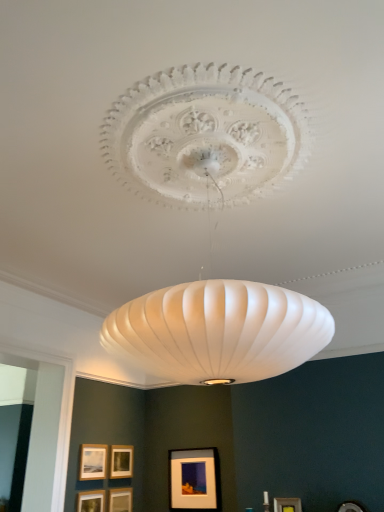
At what (x,y) coordinates should I click in order to perform the action: click on matte gold picture frame at lower left, which is the first picture frame from left to right. Please return your answer as a coordinate pair (x, y). This screenshot has height=512, width=384. Looking at the image, I should click on (93, 462).

What do you see at coordinates (121, 461) in the screenshot?
I see `matte gold picture frame at center, acting as the 4th picture frame starting from the right` at bounding box center [121, 461].

Identify the location of matte black picture frame at lower center, marked as the fifth picture frame in a left-to-right arrangement. (194, 479).

What do you see at coordinates (91, 501) in the screenshot?
I see `matte gold picture frame at lower center, which is counted as the second picture frame, starting from the left` at bounding box center [91, 501].

Where is `wooden picture frame at lower center, the 3th picture frame positioned from the right`? The image size is (384, 512). wooden picture frame at lower center, the 3th picture frame positioned from the right is located at coordinates (120, 500).

Consider the image. How much space does matte gold picture frame at lower center, the 1th picture frame when ordered from right to left, occupy vertically?

matte gold picture frame at lower center, the 1th picture frame when ordered from right to left, is 7.61 inches tall.

In order to click on matte gold picture frame at lower left, which is the first picture frame from left to right in this screenshot , I will do `click(93, 462)`.

Is matte black picture frame at lower center, marked as the 2th picture frame in a right-to-left arrangement, turned away from matte gold picture frame at lower center, which is the fifth picture frame from right to left?

No, matte black picture frame at lower center, marked as the 2th picture frame in a right-to-left arrangement,'s orientation is not away from matte gold picture frame at lower center, which is the fifth picture frame from right to left.

Consider the image. Is matte black picture frame at lower center, marked as the fifth picture frame in a left-to-right arrangement, further to the viewer compared to matte gold picture frame at lower center, which is counted as the second picture frame, starting from the left?

Yes, matte black picture frame at lower center, marked as the fifth picture frame in a left-to-right arrangement, is further from the camera.

Who is shorter, matte black picture frame at lower center, marked as the 2th picture frame in a right-to-left arrangement, or matte gold picture frame at lower center, which is the fifth picture frame from right to left?

Standing shorter between the two is matte gold picture frame at lower center, which is the fifth picture frame from right to left.

Can you confirm if matte black picture frame at lower center, marked as the fifth picture frame in a left-to-right arrangement, is wider than matte gold picture frame at lower center, which is counted as the second picture frame, starting from the left?

Indeed, matte black picture frame at lower center, marked as the fifth picture frame in a left-to-right arrangement, has a greater width compared to matte gold picture frame at lower center, which is counted as the second picture frame, starting from the left.

How distant is wooden picture frame at lower center, the 3th picture frame positioned from the right, from matte gold picture frame at lower center, which is counted as the second picture frame, starting from the left?

22.09 centimeters.

From the image's perspective, is wooden picture frame at lower center, which ranks as the fourth picture frame in left-to-right order, on matte gold picture frame at lower center, which is counted as the second picture frame, starting from the left?

No, from the image's perspective, wooden picture frame at lower center, which ranks as the fourth picture frame in left-to-right order, is not over matte gold picture frame at lower center, which is counted as the second picture frame, starting from the left.

From a real-world perspective, between wooden picture frame at lower center, the 3th picture frame positioned from the right, and matte gold picture frame at lower center, which is counted as the second picture frame, starting from the left, who is vertically higher?

In real-world perspective, matte gold picture frame at lower center, which is counted as the second picture frame, starting from the left, is above.

Can you confirm if wooden picture frame at lower center, the 3th picture frame positioned from the right, is bigger than matte gold picture frame at lower center, which is the fifth picture frame from right to left?

No.

From the image's perspective, is matte gold picture frame at lower center, marked as the sixth picture frame in a left-to-right arrangement, positioned above or below matte gold picture frame at center, acting as the 4th picture frame starting from the right?

Clearly, from the image's perspective, matte gold picture frame at lower center, marked as the sixth picture frame in a left-to-right arrangement, is above matte gold picture frame at center, acting as the 4th picture frame starting from the right.

Looking at this image, from a real-world perspective, which object stands above the other?

matte gold picture frame at center, which ranks as the 3th picture frame in left-to-right order.

From their relative heights in the image, would you say matte gold picture frame at lower center, marked as the sixth picture frame in a left-to-right arrangement, is taller or shorter than matte gold picture frame at center, which ranks as the 3th picture frame in left-to-right order?

Considering their sizes, matte gold picture frame at lower center, marked as the sixth picture frame in a left-to-right arrangement, has less height than matte gold picture frame at center, which ranks as the 3th picture frame in left-to-right order.

Is matte gold picture frame at lower center, marked as the sixth picture frame in a left-to-right arrangement, to the left of matte gold picture frame at center, which ranks as the 3th picture frame in left-to-right order, from the viewer's perspective?

No, matte gold picture frame at lower center, marked as the sixth picture frame in a left-to-right arrangement, is not to the left of matte gold picture frame at center, which ranks as the 3th picture frame in left-to-right order.

Does matte gold picture frame at lower center, which is counted as the second picture frame, starting from the left, have a lesser height compared to matte black picture frame at lower center, marked as the 2th picture frame in a right-to-left arrangement?

Correct, matte gold picture frame at lower center, which is counted as the second picture frame, starting from the left, is not as tall as matte black picture frame at lower center, marked as the 2th picture frame in a right-to-left arrangement.

Is matte gold picture frame at lower center, which is the fifth picture frame from right to left, turned away from matte black picture frame at lower center, marked as the 2th picture frame in a right-to-left arrangement?

No, matte gold picture frame at lower center, which is the fifth picture frame from right to left, is not facing the opposite direction of matte black picture frame at lower center, marked as the 2th picture frame in a right-to-left arrangement.

From the image's perspective, who appears lower, matte gold picture frame at lower center, which is counted as the second picture frame, starting from the left, or matte black picture frame at lower center, marked as the 2th picture frame in a right-to-left arrangement?

From the image's view, matte gold picture frame at lower center, which is counted as the second picture frame, starting from the left, is below.

Which is correct: matte gold picture frame at lower left, which is the first picture frame from left to right, is inside matte gold picture frame at lower center, marked as the sixth picture frame in a left-to-right arrangement, or outside of it?

matte gold picture frame at lower left, which is the first picture frame from left to right, is not enclosed by matte gold picture frame at lower center, marked as the sixth picture frame in a left-to-right arrangement.

Who is taller, matte gold picture frame at lower left, which is the first picture frame from left to right, or matte gold picture frame at lower center, marked as the sixth picture frame in a left-to-right arrangement?

Standing taller between the two is matte gold picture frame at lower left, which is the first picture frame from left to right.

Does matte gold picture frame at lower left, which appears as the sixth picture frame when viewed from the right, turn towards matte gold picture frame at lower center, marked as the sixth picture frame in a left-to-right arrangement?

Yes, matte gold picture frame at lower left, which appears as the sixth picture frame when viewed from the right, is aimed at matte gold picture frame at lower center, marked as the sixth picture frame in a left-to-right arrangement.

Who is more distant, matte gold picture frame at lower left, which is the first picture frame from left to right, or matte gold picture frame at lower center, the 1th picture frame when ordered from right to left?

matte gold picture frame at lower left, which is the first picture frame from left to right, is more distant.

Would you say matte gold picture frame at lower center, which is the fifth picture frame from right to left, is inside or outside matte gold picture frame at lower left, which is the first picture frame from left to right?

matte gold picture frame at lower center, which is the fifth picture frame from right to left, lies outside matte gold picture frame at lower left, which is the first picture frame from left to right.

Is matte gold picture frame at lower center, which is counted as the second picture frame, starting from the left, wider than matte gold picture frame at lower left, which is the first picture frame from left to right?

Correct, the width of matte gold picture frame at lower center, which is counted as the second picture frame, starting from the left, exceeds that of matte gold picture frame at lower left, which is the first picture frame from left to right.

Is matte gold picture frame at lower center, which is the fifth picture frame from right to left, far from matte gold picture frame at lower left, which is the first picture frame from left to right?

They are positioned close to each other.

Considering their positions, is matte gold picture frame at lower center, which is counted as the second picture frame, starting from the left, located in front of or behind matte gold picture frame at lower left, which is the first picture frame from left to right?

Clearly, matte gold picture frame at lower center, which is counted as the second picture frame, starting from the left, is in front of matte gold picture frame at lower left, which is the first picture frame from left to right.

From a real-world perspective, which is physically below, matte black picture frame at lower center, marked as the 2th picture frame in a right-to-left arrangement, or matte gold picture frame at lower left, which is the first picture frame from left to right?

matte black picture frame at lower center, marked as the 2th picture frame in a right-to-left arrangement, from a real-world perspective.

Can you confirm if matte black picture frame at lower center, marked as the fifth picture frame in a left-to-right arrangement, is taller than matte gold picture frame at lower left, which is the first picture frame from left to right?

Correct, matte black picture frame at lower center, marked as the fifth picture frame in a left-to-right arrangement, is much taller as matte gold picture frame at lower left, which is the first picture frame from left to right.

In the scene shown: Considering the sizes of matte black picture frame at lower center, marked as the 2th picture frame in a right-to-left arrangement, and matte gold picture frame at lower left, which appears as the sixth picture frame when viewed from the right, in the image, is matte black picture frame at lower center, marked as the 2th picture frame in a right-to-left arrangement, wider or thinner than matte gold picture frame at lower left, which appears as the sixth picture frame when viewed from the right,?

Considering their sizes, matte black picture frame at lower center, marked as the 2th picture frame in a right-to-left arrangement, looks broader than matte gold picture frame at lower left, which appears as the sixth picture frame when viewed from the right.

Could matte gold picture frame at lower left, which is the first picture frame from left to right, be considered to be inside matte black picture frame at lower center, marked as the 2th picture frame in a right-to-left arrangement?

No, matte gold picture frame at lower left, which is the first picture frame from left to right, is not inside matte black picture frame at lower center, marked as the 2th picture frame in a right-to-left arrangement.

Locate an element on the screen. The image size is (384, 512). the 3rd picture frame behind when counting from the matte gold picture frame at lower center, which is the fifth picture frame from right to left is located at coordinates (194, 479).

Find the location of a particular element. This screenshot has height=512, width=384. the 1st picture frame above the wooden picture frame at lower center, the 3th picture frame positioned from the right (from the image's perspective) is located at coordinates (91, 501).

Based on their spatial positions, is wooden picture frame at lower center, the 3th picture frame positioned from the right, or matte gold picture frame at center, acting as the 4th picture frame starting from the right, closer to matte gold picture frame at lower center, the 1th picture frame when ordered from right to left?

The object closer to matte gold picture frame at lower center, the 1th picture frame when ordered from right to left, is matte gold picture frame at center, acting as the 4th picture frame starting from the right.

Based on the photo, when comparing their distances from matte gold picture frame at lower center, the 1th picture frame when ordered from right to left, does matte gold picture frame at center, acting as the 4th picture frame starting from the right, or matte black picture frame at lower center, marked as the fifth picture frame in a left-to-right arrangement, seem closer?

Among the two, matte black picture frame at lower center, marked as the fifth picture frame in a left-to-right arrangement, is located nearer to matte gold picture frame at lower center, the 1th picture frame when ordered from right to left.

Looking at the image, which one is located closer to wooden picture frame at lower center, the 3th picture frame positioned from the right, matte gold picture frame at lower center, the 1th picture frame when ordered from right to left, or matte black picture frame at lower center, marked as the fifth picture frame in a left-to-right arrangement?

Among the two, matte black picture frame at lower center, marked as the fifth picture frame in a left-to-right arrangement, is located nearer to wooden picture frame at lower center, the 3th picture frame positioned from the right.

Considering their positions, is matte gold picture frame at lower center, the 1th picture frame when ordered from right to left, positioned further to matte gold picture frame at lower left, which appears as the sixth picture frame when viewed from the right, than matte gold picture frame at center, which ranks as the 3th picture frame in left-to-right order?

Among the two, matte gold picture frame at lower center, the 1th picture frame when ordered from right to left, is located further to matte gold picture frame at lower left, which appears as the sixth picture frame when viewed from the right.

Looking at the image, which one is located closer to matte gold picture frame at lower center, marked as the sixth picture frame in a left-to-right arrangement, matte black picture frame at lower center, marked as the fifth picture frame in a left-to-right arrangement, or matte gold picture frame at lower left, which is the first picture frame from left to right?

The object closer to matte gold picture frame at lower center, marked as the sixth picture frame in a left-to-right arrangement, is matte black picture frame at lower center, marked as the fifth picture frame in a left-to-right arrangement.

Looking at the image, which one is located further to matte gold picture frame at lower center, marked as the sixth picture frame in a left-to-right arrangement, matte gold picture frame at lower left, which is the first picture frame from left to right, or matte gold picture frame at center, which ranks as the 3th picture frame in left-to-right order?

matte gold picture frame at lower left, which is the first picture frame from left to right.

Based on their spatial positions, is matte black picture frame at lower center, marked as the fifth picture frame in a left-to-right arrangement, or matte gold picture frame at lower left, which is the first picture frame from left to right, closer to matte gold picture frame at center, acting as the 4th picture frame starting from the right?

matte gold picture frame at lower left, which is the first picture frame from left to right.

When comparing their distances from matte gold picture frame at center, acting as the 4th picture frame starting from the right, does matte gold picture frame at lower center, marked as the sixth picture frame in a left-to-right arrangement, or matte black picture frame at lower center, marked as the fifth picture frame in a left-to-right arrangement, seem further?

The object further to matte gold picture frame at center, acting as the 4th picture frame starting from the right, is matte gold picture frame at lower center, marked as the sixth picture frame in a left-to-right arrangement.

Where is `picture frame located between matte gold picture frame at center, acting as the 4th picture frame starting from the right, and matte black picture frame at lower center, marked as the fifth picture frame in a left-to-right arrangement, in the left-right direction`? The image size is (384, 512). picture frame located between matte gold picture frame at center, acting as the 4th picture frame starting from the right, and matte black picture frame at lower center, marked as the fifth picture frame in a left-to-right arrangement, in the left-right direction is located at coordinates [x=120, y=500].

I want to click on picture frame between wooden picture frame at lower center, the 3th picture frame positioned from the right, and matte gold picture frame at lower center, the 1th picture frame when ordered from right to left, from left to right, so click(x=194, y=479).